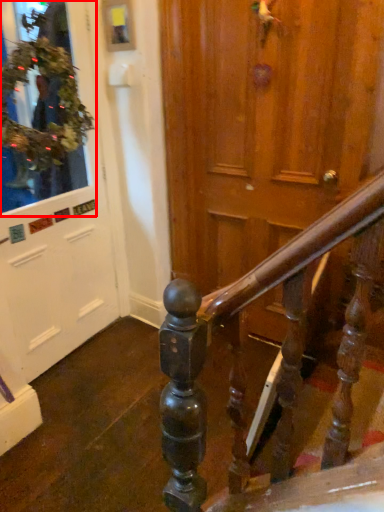
Question: From the image, what is the correct spatial relationship of shop window (annotated by the red box) in relation to door?

Choices:
 (A) right
 (B) left

Answer: (A)